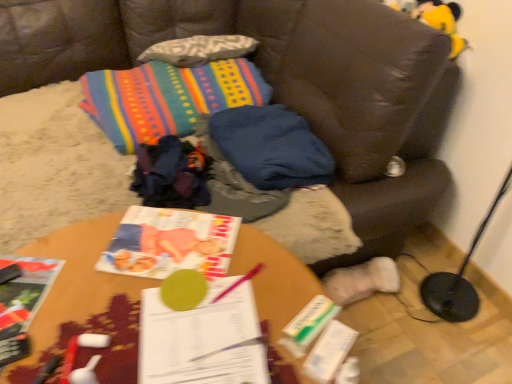
Locate an element on the screen. The height and width of the screenshot is (384, 512). vacant position to the left of matte paper book at center, which is counted as the 2th book, starting from the right is located at coordinates (78, 276).